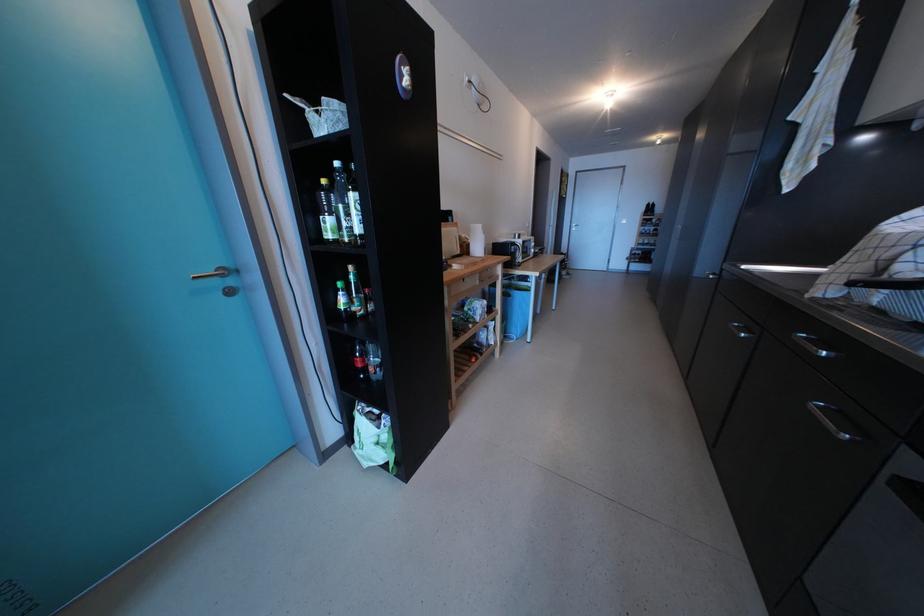
Where would you lift the white plastic container? Please return your answer as a coordinate pair (x, y).

(476, 240)